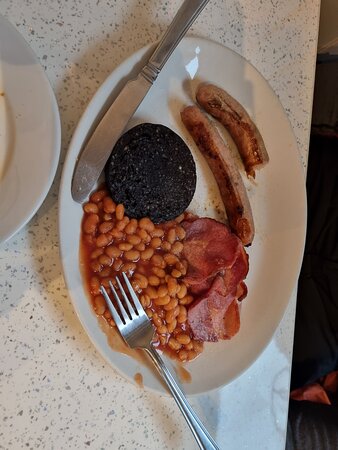
The height and width of the screenshot is (450, 338). Identify the location of fork spokes or teeth. (113, 313).